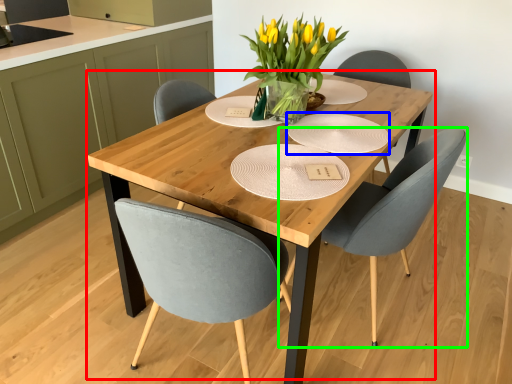
Question: Based on their relative distances, which object is nearer to kitchen & dining room table (highlighted by a red box)? Choose from paper plate (highlighted by a blue box) and chair (highlighted by a green box).

Choices:
 (A) paper plate
 (B) chair

Answer: (A)